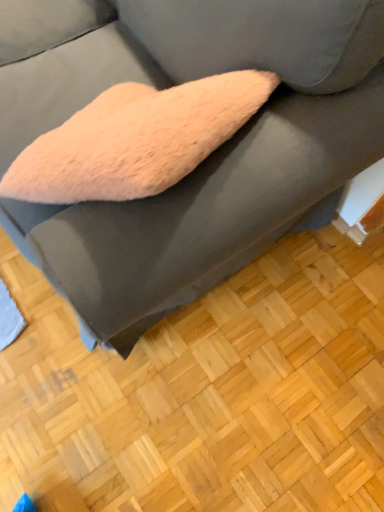
Question: Is light brown wood flooring at lower center in contact with fuzzy pink pillow at center?

Choices:
 (A) yes
 (B) no

Answer: (B)

Question: From a real-world perspective, is light brown wood flooring at lower center on fuzzy pink pillow at center?

Choices:
 (A) yes
 (B) no

Answer: (B)

Question: From a real-world perspective, is light brown wood flooring at lower center below fuzzy pink pillow at center?

Choices:
 (A) no
 (B) yes

Answer: (B)

Question: Does light brown wood flooring at lower center lie behind fuzzy pink pillow at center?

Choices:
 (A) yes
 (B) no

Answer: (A)

Question: Considering the relative sizes of light brown wood flooring at lower center and fuzzy pink pillow at center in the image provided, is light brown wood flooring at lower center wider than fuzzy pink pillow at center?

Choices:
 (A) yes
 (B) no

Answer: (A)

Question: Is the position of light brown wood flooring at lower center less distant than that of fuzzy pink pillow at center?

Choices:
 (A) no
 (B) yes

Answer: (A)

Question: From a real-world perspective, is fuzzy pink pillow at center on top of light brown wood flooring at lower center?

Choices:
 (A) yes
 (B) no

Answer: (A)

Question: Is fuzzy pink pillow at center at the left side of light brown wood flooring at lower center?

Choices:
 (A) yes
 (B) no

Answer: (A)

Question: Can you confirm if fuzzy pink pillow at center is thinner than light brown wood flooring at lower center?

Choices:
 (A) yes
 (B) no

Answer: (A)

Question: Can you confirm if fuzzy pink pillow at center is shorter than light brown wood flooring at lower center?

Choices:
 (A) yes
 (B) no

Answer: (B)

Question: Are fuzzy pink pillow at center and light brown wood flooring at lower center making contact?

Choices:
 (A) yes
 (B) no

Answer: (B)

Question: Is fuzzy pink pillow at center bigger than light brown wood flooring at lower center?

Choices:
 (A) no
 (B) yes

Answer: (B)

Question: Is fuzzy pink pillow at center inside the boundaries of light brown wood flooring at lower center, or outside?

Choices:
 (A) outside
 (B) inside

Answer: (A)